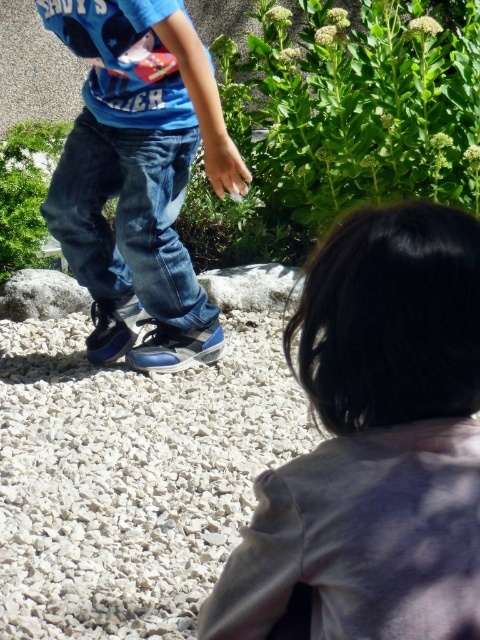
Question: Which point is closer to the camera?

Choices:
 (A) (175, 308)
 (B) (300, 378)

Answer: (B)

Question: Does smooth gray shirt at lower right appear on the left side of white gravel at center?

Choices:
 (A) yes
 (B) no

Answer: (B)

Question: Does smooth gray shirt at lower right appear under white gravel at center?

Choices:
 (A) yes
 (B) no

Answer: (B)

Question: Does smooth gray shirt at lower right lie behind denim jeans at center?

Choices:
 (A) no
 (B) yes

Answer: (A)

Question: Which of these objects is positioned farthest from the white gravel at center?

Choices:
 (A) smooth gray shirt at lower right
 (B) denim jeans at center

Answer: (A)

Question: Among these objects, which one is nearest to the camera?

Choices:
 (A) denim jeans at center
 (B) smooth gray shirt at lower right
 (C) white gravel at center

Answer: (B)